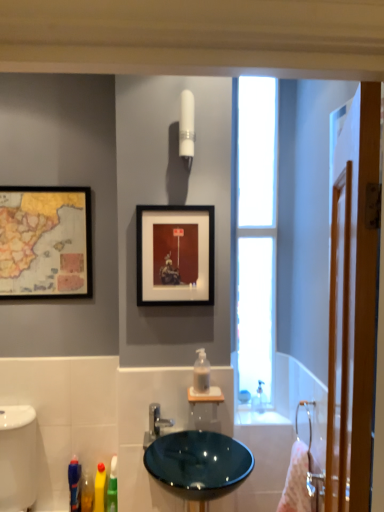
Question: From the image's perspective, does wooden screen door at right appear lower than pink fabric towel at right?

Choices:
 (A) no
 (B) yes

Answer: (A)

Question: Could pink fabric towel at right be considered to be inside wooden screen door at right?

Choices:
 (A) yes
 (B) no

Answer: (B)

Question: Is wooden screen door at right oriented towards pink fabric towel at right?

Choices:
 (A) no
 (B) yes

Answer: (A)

Question: Is the position of wooden screen door at right more distant than that of pink fabric towel at right?

Choices:
 (A) yes
 (B) no

Answer: (B)

Question: Does wooden screen door at right appear on the right side of pink fabric towel at right?

Choices:
 (A) yes
 (B) no

Answer: (B)

Question: Does wooden screen door at right touch pink fabric towel at right?

Choices:
 (A) no
 (B) yes

Answer: (A)

Question: Considering the relative sizes of white glossy bidet at lower left and satin nickel faucet at center in the image provided, is white glossy bidet at lower left shorter than satin nickel faucet at center?

Choices:
 (A) yes
 (B) no

Answer: (B)

Question: Considering the relative positions of white glossy bidet at lower left and satin nickel faucet at center in the image provided, is white glossy bidet at lower left to the left of satin nickel faucet at center from the viewer's perspective?

Choices:
 (A) yes
 (B) no

Answer: (A)

Question: Does white glossy bidet at lower left have a greater width compared to satin nickel faucet at center?

Choices:
 (A) no
 (B) yes

Answer: (B)

Question: Considering the relative sizes of white glossy bidet at lower left and satin nickel faucet at center in the image provided, is white glossy bidet at lower left smaller than satin nickel faucet at center?

Choices:
 (A) no
 (B) yes

Answer: (A)

Question: Does white glossy bidet at lower left touch satin nickel faucet at center?

Choices:
 (A) yes
 (B) no

Answer: (B)

Question: Does white glossy bidet at lower left turn towards satin nickel faucet at center?

Choices:
 (A) yes
 (B) no

Answer: (B)

Question: Is transparent glass window at right located outside satin nickel faucet at center?

Choices:
 (A) no
 (B) yes

Answer: (B)